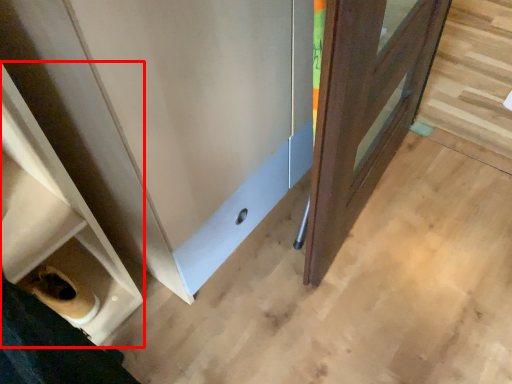
Question: Considering the relative positions of shelf (annotated by the red box) and door in the image provided, where is shelf (annotated by the red box) located with respect to the staircase?

Choices:
 (A) right
 (B) left

Answer: (B)